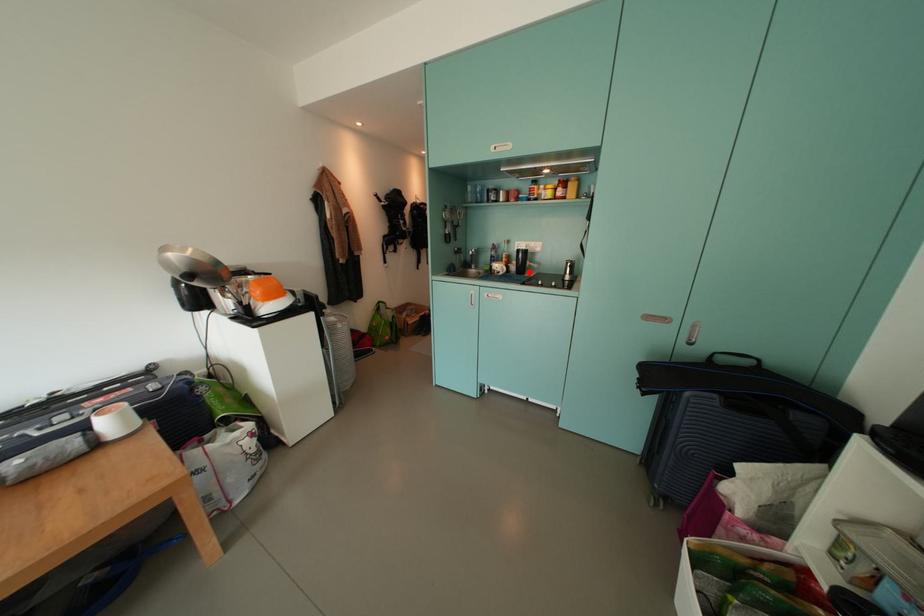
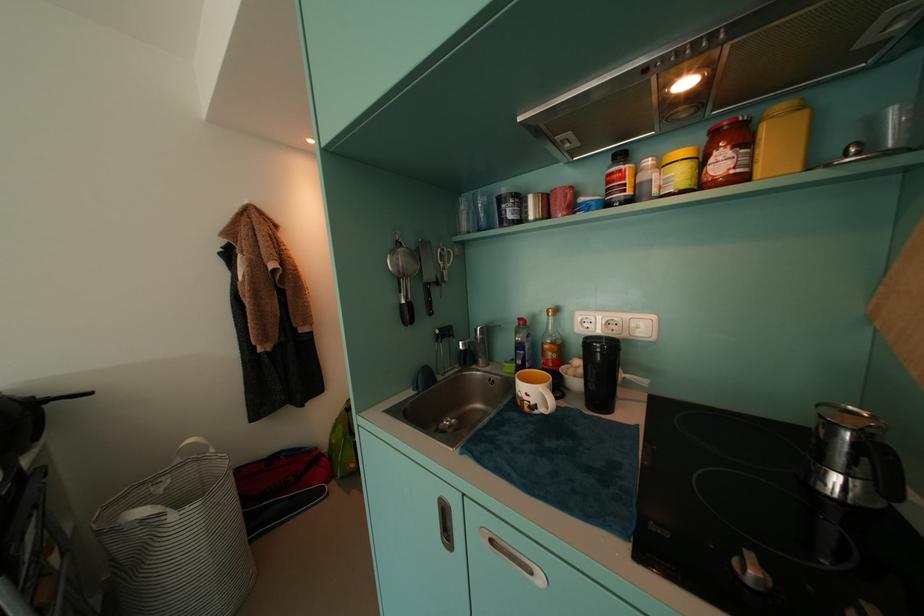
Locate, in the second image, the point that corresponds to the highlighted location in the first image.

(610, 395)